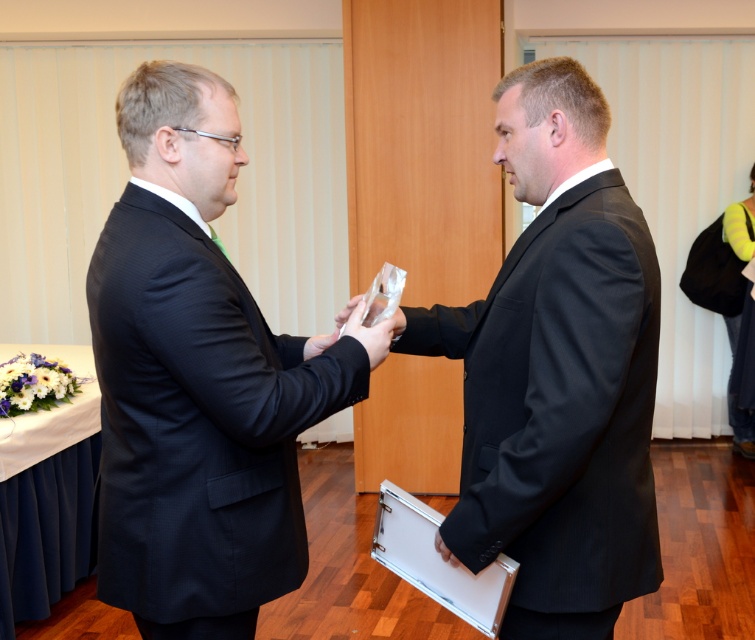
Question: Does matte black suit at left have a greater width compared to black pinstripe suit at center?

Choices:
 (A) no
 (B) yes

Answer: (B)

Question: Estimate the real-world distances between objects in this image. Which object is closer to the translucent plastic hand at center?

Choices:
 (A) matte black suit at left
 (B) black pinstripe suit at center

Answer: (A)

Question: Which object is positioned closest to the translucent plastic hand at center?

Choices:
 (A) black pinstripe suit at center
 (B) matte black suit at left

Answer: (B)

Question: Based on their relative distances, which object is nearer to the translucent plastic hand at center?

Choices:
 (A) black pinstripe suit at center
 (B) matte black suit at left

Answer: (B)

Question: Does black pinstripe suit at center have a lesser width compared to translucent plastic hand at center?

Choices:
 (A) yes
 (B) no

Answer: (B)

Question: Is matte black suit at left positioned before translucent plastic hand at center?

Choices:
 (A) no
 (B) yes

Answer: (B)